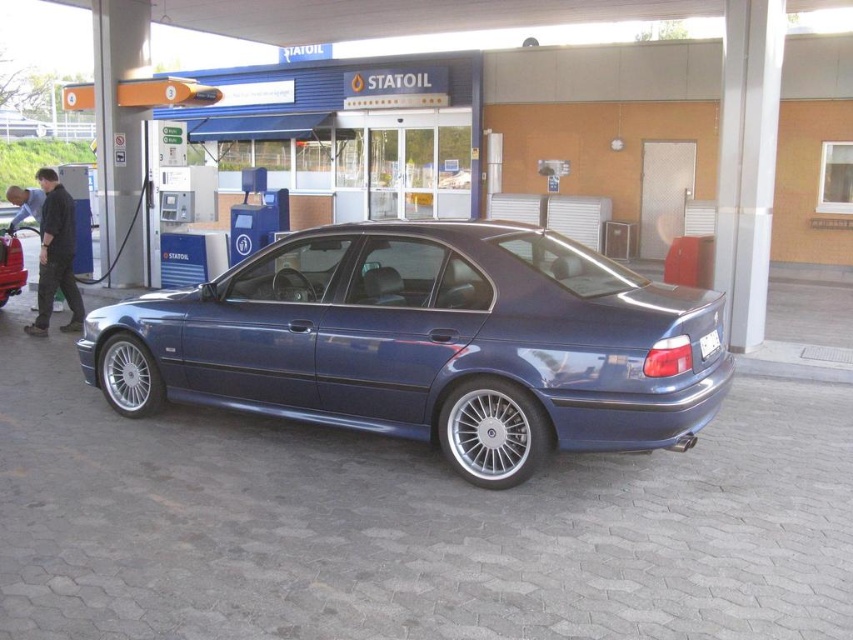
You are a delivery person who needs to load a package onto the roof of the matte blue sedan at center. Considering the white plastic license plate at rear, will the package cover the license plate if placed directly on top of the car?

The matte blue sedan at center is larger in size compared to the white plastic license plate at rear. However, the license plate is located at the rear of the car, while the package would be placed on the roof. Since the roof and rear are different areas of the vehicle, the package will not cover the license plate.

You are standing at the point labeled point (646, 292) and want to reach the gas station entrance located at the opposite corner. The minimum distance you need to walk is 14.66 feet. Is this distance enough to safely walk to the entrance without crossing any obstacles?

The distance between you and the gas station entrance is exactly 14.66 feet, which is the minimum required to reach the entrance safely without crossing any obstacles.

You are a delivery driver who needs to park your van behind the metallic blue sedan at center without blocking the white plastic license plate at rear. Is this possible?

The metallic blue sedan at center is in front of the white plastic license plate at rear, so parking behind the metallic blue sedan at center would place your van further away from the license plate, thus not blocking it.